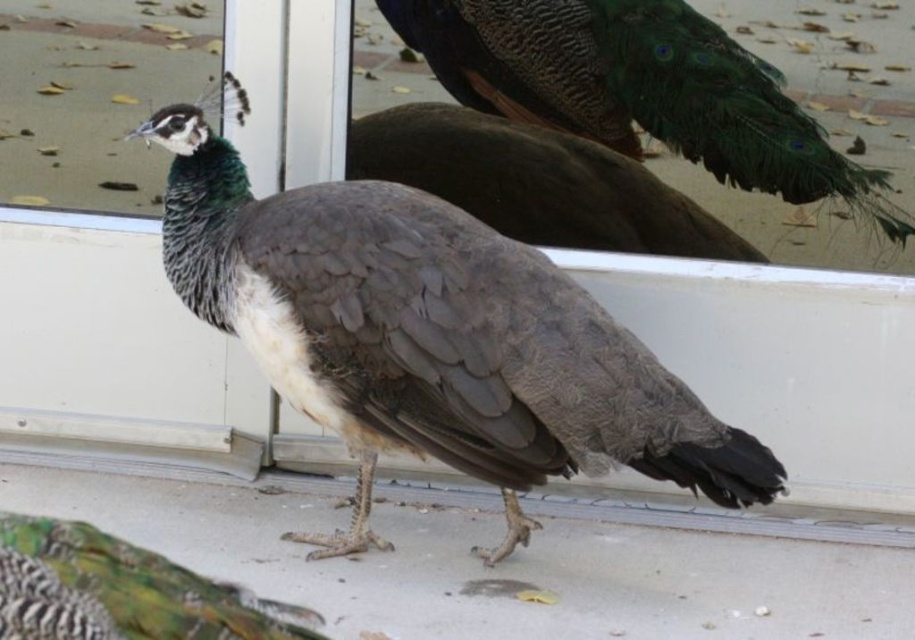
Question: Is shiny green peacock at center smaller than green iridescent feathers at center?

Choices:
 (A) no
 (B) yes

Answer: (A)

Question: Which of the following is the farthest from the observer?

Choices:
 (A) (886, 150)
 (B) (573, 435)

Answer: (A)

Question: Estimate the real-world distances between objects in this image. Which object is closer to the green iridescent feathers at center?

Choices:
 (A) dark gray feathers at center
 (B) shiny green peacock at center

Answer: (A)

Question: Can you confirm if dark gray feathers at center is positioned to the right of shiny green peacock at center?

Choices:
 (A) no
 (B) yes

Answer: (A)

Question: Which point is closer to the camera?

Choices:
 (A) (445, 80)
 (B) (702, 456)
 (C) (0, 605)

Answer: (C)

Question: Is dark gray feathers at center above shiny green peacock at center?

Choices:
 (A) yes
 (B) no

Answer: (B)